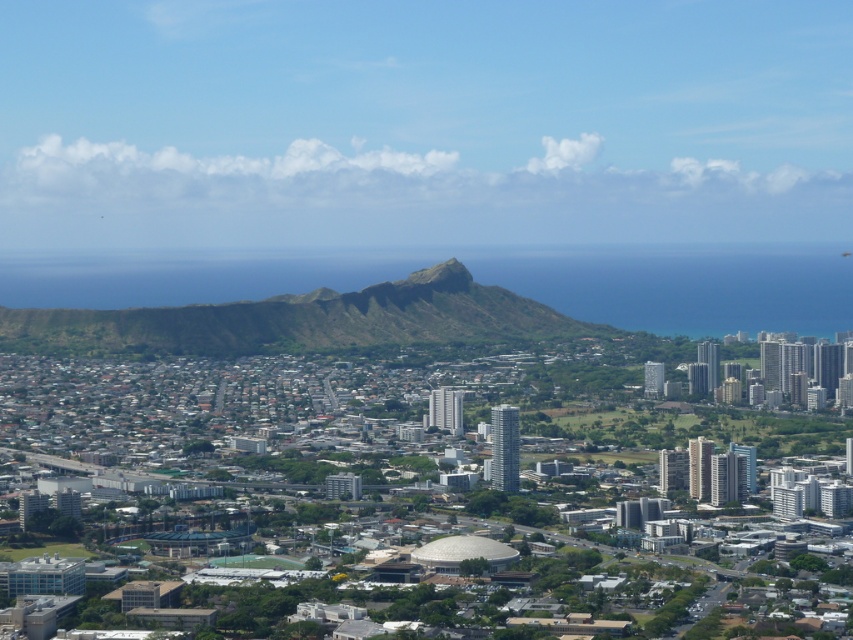
Which is in front, point (67, 346) or point (461, 285)?

Point (461, 285)

Looking at this image, is green grassy hill at center to the left of green grassy peak at center from the viewer's perspective?

Correct, you'll find green grassy hill at center to the left of green grassy peak at center.

The width and height of the screenshot is (853, 640). In order to click on green grassy hill at center in this screenshot , I will do `click(294, 323)`.